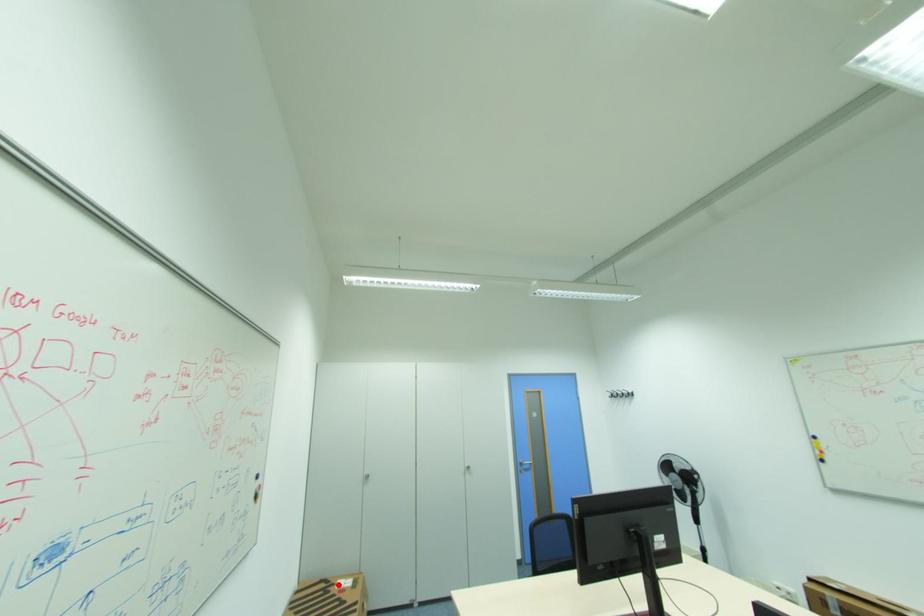
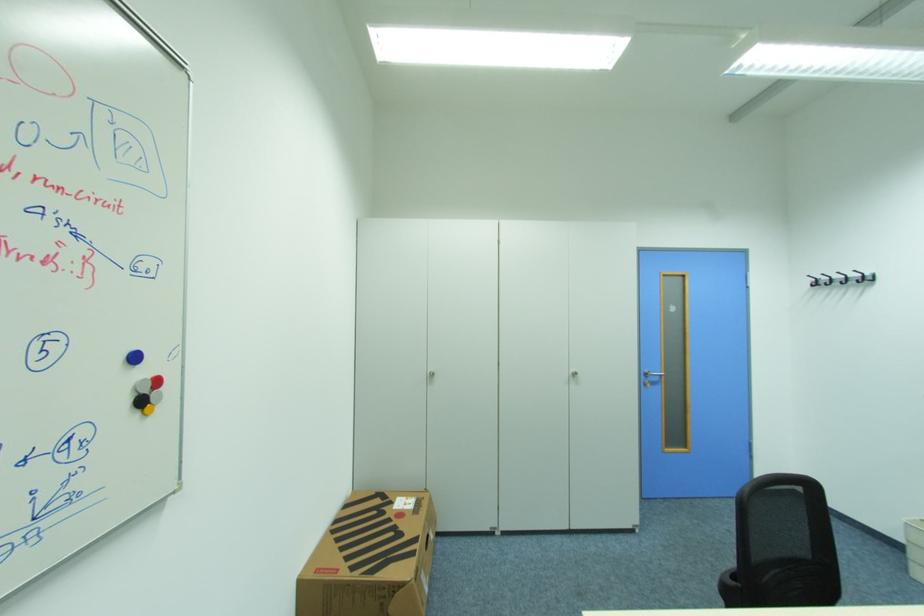
Find the pixel in the second image that matches the highlighted location in the first image.

(396, 503)